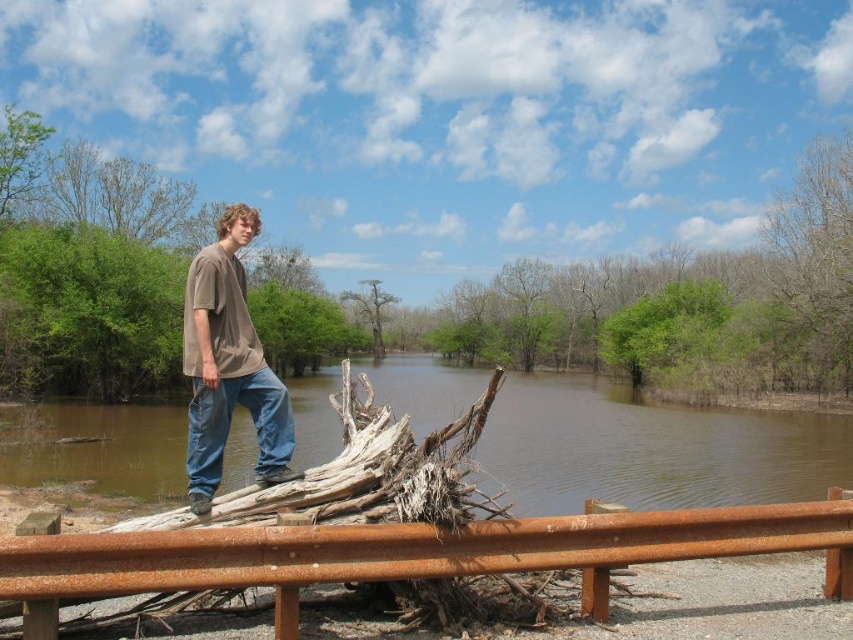
Question: Observing the image, what is the correct spatial positioning of brown wood tree at center in reference to smooth bark tree at center?

Choices:
 (A) above
 (B) below

Answer: (A)

Question: Which of the following is the farthest from the observer?

Choices:
 (A) (839, 221)
 (B) (16, 172)

Answer: (A)

Question: Among these objects, which one is farthest from the camera?

Choices:
 (A) smooth bark tree at center
 (B) green leafy tree at upper left

Answer: (A)

Question: Is the position of brown wood tree at center more distant than that of smooth bark tree at center?

Choices:
 (A) yes
 (B) no

Answer: (B)

Question: Among these objects, which one is farthest from the camera?

Choices:
 (A) brown wood tree at center
 (B) rusty metal rail at lower center

Answer: (A)

Question: Is brown cotton shirt at center to the right of bare wood tree at upper right from the viewer's perspective?

Choices:
 (A) yes
 (B) no

Answer: (B)